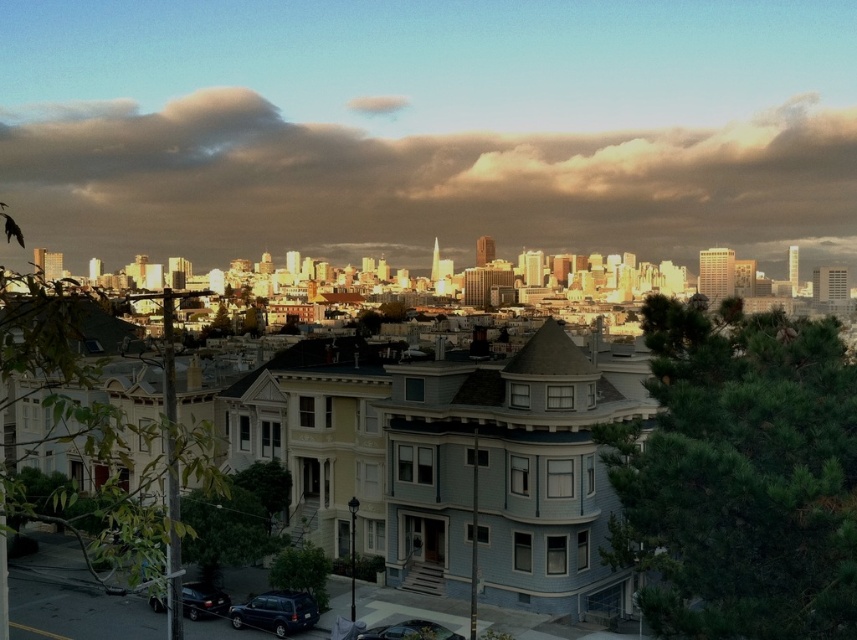
Can you confirm if shiny black sedan at lower left is smaller than metallic silver car at lower center?

No, shiny black sedan at lower left is not smaller than metallic silver car at lower center.

Does point (219, 608) come behind point (388, 637)?

Yes, it is behind point (388, 637).

Image resolution: width=857 pixels, height=640 pixels. In order to click on shiny black sedan at lower left in this screenshot , I will do `click(202, 600)`.

What do you see at coordinates (276, 612) in the screenshot? The image size is (857, 640). I see `matte black suv at lower left` at bounding box center [276, 612].

Identify the location of matte black suv at lower left. (276, 612).

Which is more to the right, cloudy sky at upper center or shiny black sedan at lower left?

From the viewer's perspective, shiny black sedan at lower left appears more on the right side.

Image resolution: width=857 pixels, height=640 pixels. What do you see at coordinates (421, 182) in the screenshot?
I see `cloudy sky at upper center` at bounding box center [421, 182].

The width and height of the screenshot is (857, 640). Find the location of `cloudy sky at upper center`. cloudy sky at upper center is located at coordinates (421, 182).